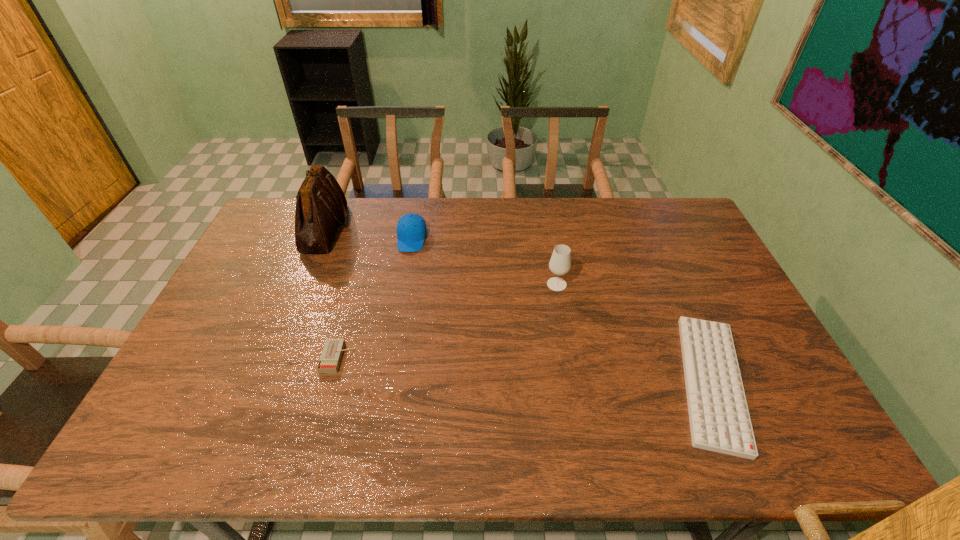
This screenshot has height=540, width=960. I want to click on free space at the far edge, so click(585, 202).

Locate an element on the screen. The image size is (960, 540). vacant space at the near edge is located at coordinates (427, 457).

At what (x,y) coordinates should I click in order to perform the action: click on free region at the left edge of the desktop. Please return your answer as a coordinate pair (x, y). This screenshot has height=540, width=960. Looking at the image, I should click on [251, 339].

Where is `vacant region between the computer keyboard and the tallest object`? The height and width of the screenshot is (540, 960). vacant region between the computer keyboard and the tallest object is located at coordinates (518, 305).

Where is `free area in between the rightmost object and the matchbox`? free area in between the rightmost object and the matchbox is located at coordinates (525, 369).

I want to click on empty location between the cap and the second object from left to right, so click(x=375, y=298).

At what (x,y) coordinates should I click in order to perform the action: click on vacant area that lies between the third shortest object and the tallest object. Please return your answer as a coordinate pair (x, y). The height and width of the screenshot is (540, 960). Looking at the image, I should click on (369, 233).

You are a GUI agent. You are given a task and a screenshot of the screen. Output one action in this format:
    pyautogui.click(x=<x>, y=<y>)
    Task: Click on the vacant area that lies between the third object from left to right and the third nearest object
    Image resolution: width=960 pixels, height=540 pixels.
    Given the screenshot: What is the action you would take?
    pyautogui.click(x=484, y=261)

The height and width of the screenshot is (540, 960). What are the coordinates of `free space between the leftmost object and the third farthest object` in the screenshot? It's located at (441, 256).

Locate an element on the screen. This screenshot has height=540, width=960. vacant space that's between the computer keyboard and the matchbox is located at coordinates (525, 369).